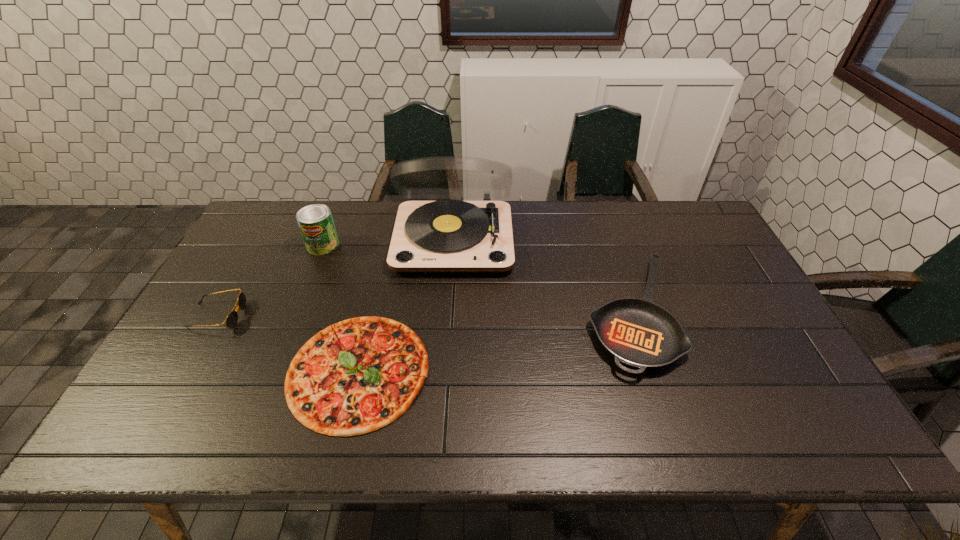
Where is `object that is the closest to the second shortest object`? The height and width of the screenshot is (540, 960). object that is the closest to the second shortest object is located at coordinates (449, 236).

Choose which object is the third nearest neighbor to the can. Please provide its 2D coordinates. Your answer should be formatted as a tuple, i.e. [(x, y)], where the tuple contains the x and y coordinates of a point satisfying the conditions above.

[(356, 376)]

Where is `vacant space that satisfies the following two spatial constraints: 1. on the back side of the shortest object; 2. on the front-facing side of the leftmost object`? The image size is (960, 540). vacant space that satisfies the following two spatial constraints: 1. on the back side of the shortest object; 2. on the front-facing side of the leftmost object is located at coordinates (372, 316).

I want to click on blank space that satisfies the following two spatial constraints: 1. on the back side of the shortest object; 2. on the left side of the rightmost object, so click(372, 314).

Locate an element on the screen. This screenshot has height=540, width=960. vacant space that satisfies the following two spatial constraints: 1. on the front-facing side of the leftmost object; 2. on the right side of the shortest object is located at coordinates (187, 370).